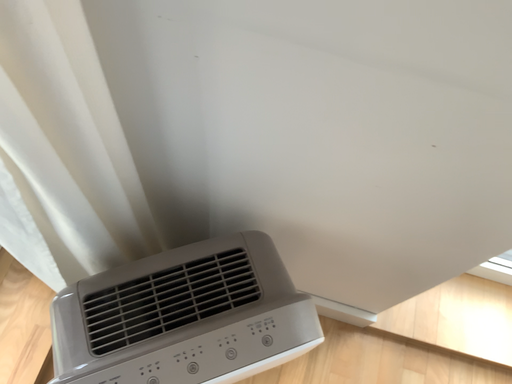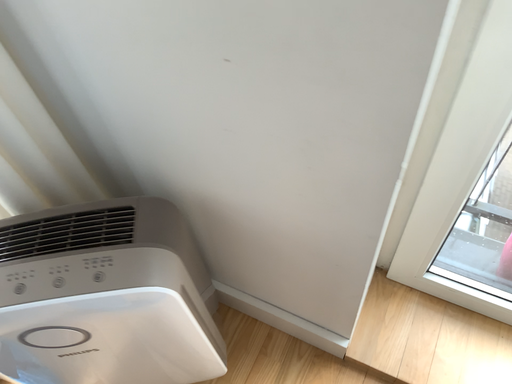
Question: How did the camera likely rotate when shooting the video?

Choices:
 (A) rotated downward
 (B) rotated upward

Answer: (B)